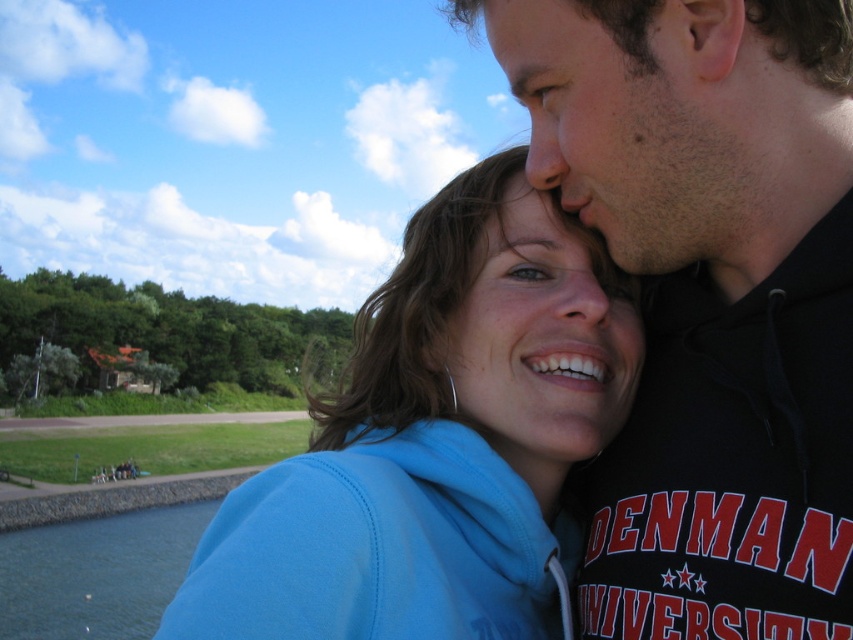
You are a photographer trying to capture a photo of the blue fleece jacket at center and the clear water at lower left. Which object is positioned to the right side of the other?

The blue fleece jacket at center is to the right of clear water at lower left.